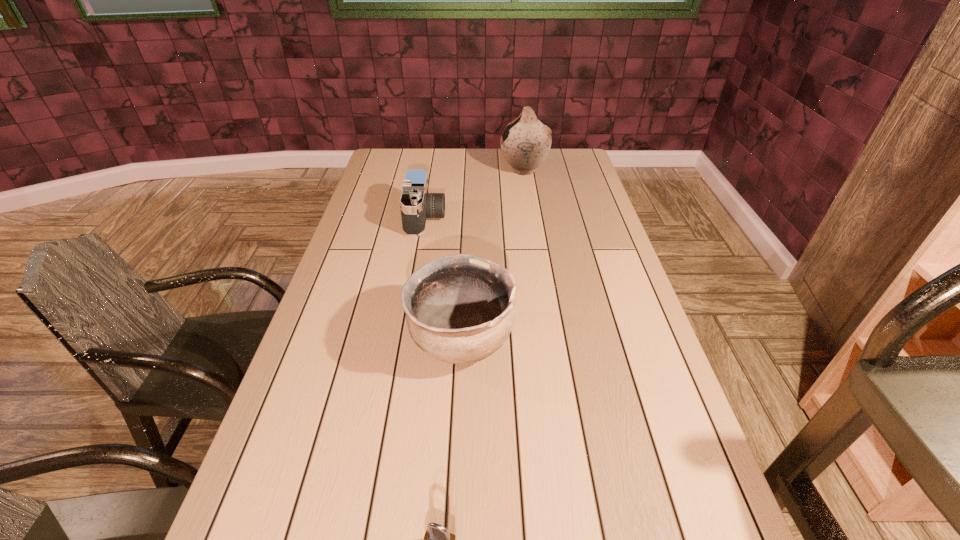
Where is `unoccupied area between the taller pottery and the camera`? The image size is (960, 540). unoccupied area between the taller pottery and the camera is located at coordinates (475, 194).

Identify the location of object identified as the third closest to the farther pottery. (437, 539).

Select which object appears as the second closest to the third farthest object. Please provide its 2D coordinates. Your answer should be formatted as a tuple, i.e. [(x, y)], where the tuple contains the x and y coordinates of a point satisfying the conditions above.

[(437, 539)]

At what (x,y) coordinates should I click in order to perform the action: click on free space that satisfies the following two spatial constraints: 1. on the front-facing side of the shorter pottery; 2. on the left side of the camera. Please return your answer as a coordinate pair (x, y). Looking at the image, I should click on (405, 340).

Find the location of `free point that satisfies the following two spatial constraints: 1. from the spout of the farther pottery; 2. on the front side of the shorter pottery`. free point that satisfies the following two spatial constraints: 1. from the spout of the farther pottery; 2. on the front side of the shorter pottery is located at coordinates (551, 340).

The image size is (960, 540). What are the coordinates of `vacant position in the image that satisfies the following two spatial constraints: 1. from the spout of the farthest object; 2. on the front side of the third farthest object` in the screenshot? It's located at (551, 340).

Find the location of `free space that satisfies the following two spatial constraints: 1. on the front-facing side of the third nearest object; 2. on the left side of the nearer pottery`. free space that satisfies the following two spatial constraints: 1. on the front-facing side of the third nearest object; 2. on the left side of the nearer pottery is located at coordinates (405, 340).